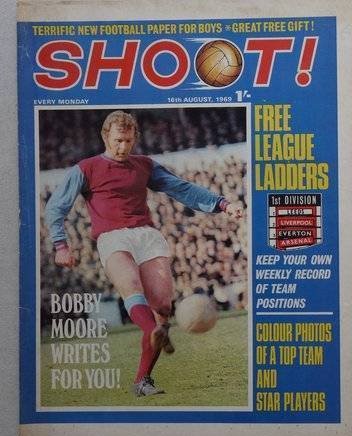
Identify the location of magazine fold staple. (19, 214).